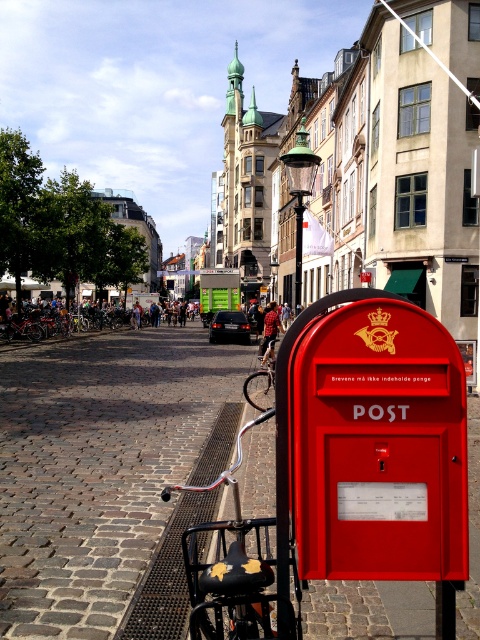
You are standing at the red postbox labeled POST in the foreground of the urban street scene. Looking towards the cobblestone pavement at lower left, which is marked by the point at coordinates (97, 467), can you determine the direction you should face to walk towards that pavement?

The point at coordinates (97, 467) marks the cobblestone pavement at lower left. Since the pavement is at the lower left relative to the postbox, you should face towards the lower left direction to walk towards it.

You are a delivery person trying to determine the best place to park your black matte bicycle at lower left near the red matte postbox at lower right. Since you need to ensure the bicycle doesn

The red matte postbox at lower right is taller than the black matte bicycle at lower left. Therefore, the bicycle can be parked near the postbox without obstructing it, as the postbox is taller and less likely to be blocked by the bicycle.